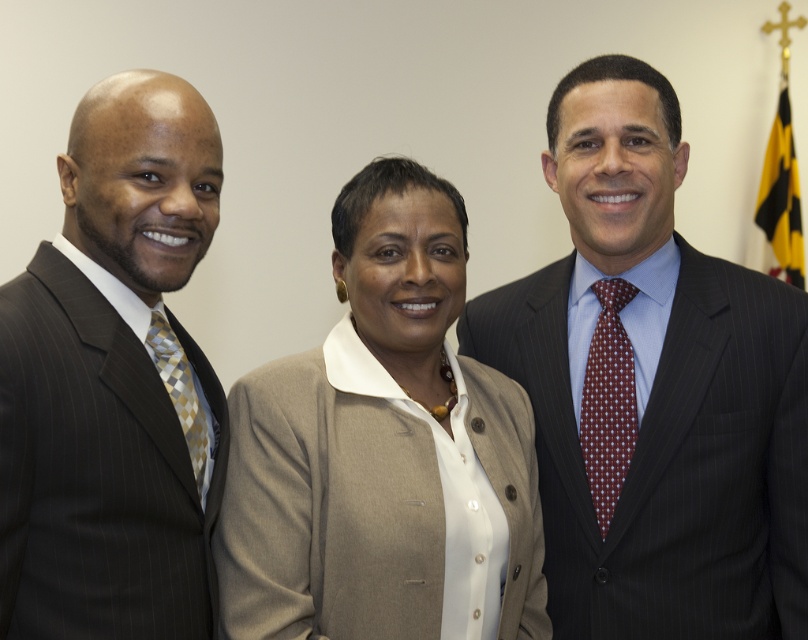
Does dark pinstripe suit at center lie in front of matte black suit at left?

No, it is behind matte black suit at left.

Is dark pinstripe suit at center bigger than matte black suit at left?

Correct, dark pinstripe suit at center is larger in size than matte black suit at left.

Who is more distant from viewer, (x=785, y=330) or (x=167, y=413)?

The point (x=785, y=330) is behind.

The height and width of the screenshot is (640, 808). Find the location of `dark pinstripe suit at center`. dark pinstripe suit at center is located at coordinates (654, 392).

Is dark pinstripe suit at center to the right of beige fabric jacket at center from the viewer's perspective?

Indeed, dark pinstripe suit at center is positioned on the right side of beige fabric jacket at center.

Does dark pinstripe suit at center appear over beige fabric jacket at center?

Yes.

Is point (621, 148) positioned before point (251, 435)?

No.

At what (x,y) coordinates should I click in order to perform the action: click on dark pinstripe suit at center. Please return your answer as a coordinate pair (x, y). The width and height of the screenshot is (808, 640). Looking at the image, I should click on (654, 392).

Based on the photo, does matte black suit at left have a smaller size compared to gold checkered tie at left?

No.

Does point (133, 221) come closer to viewer compared to point (196, 426)?

Yes, point (133, 221) is closer to viewer.

Find the location of `matte black suit at left`. matte black suit at left is located at coordinates (112, 381).